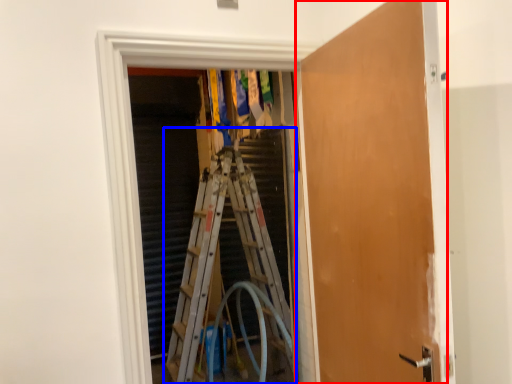
Question: Which object is further to the camera taking this photo, door (highlighted by a red box) or ladder (highlighted by a blue box)?

Choices:
 (A) door
 (B) ladder

Answer: (B)